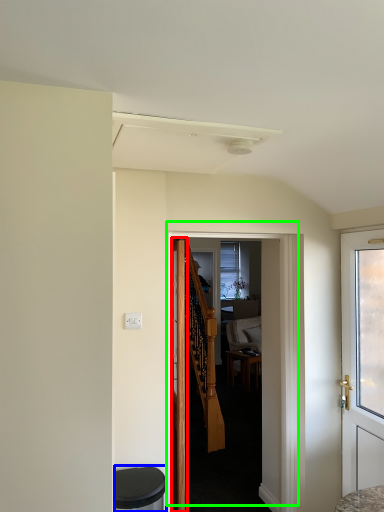
Question: Considering the real-world distances, which object is closest to door (highlighted by a red box)? music stool (highlighted by a blue box) or door (highlighted by a green box).

Choices:
 (A) music stool
 (B) door

Answer: (B)